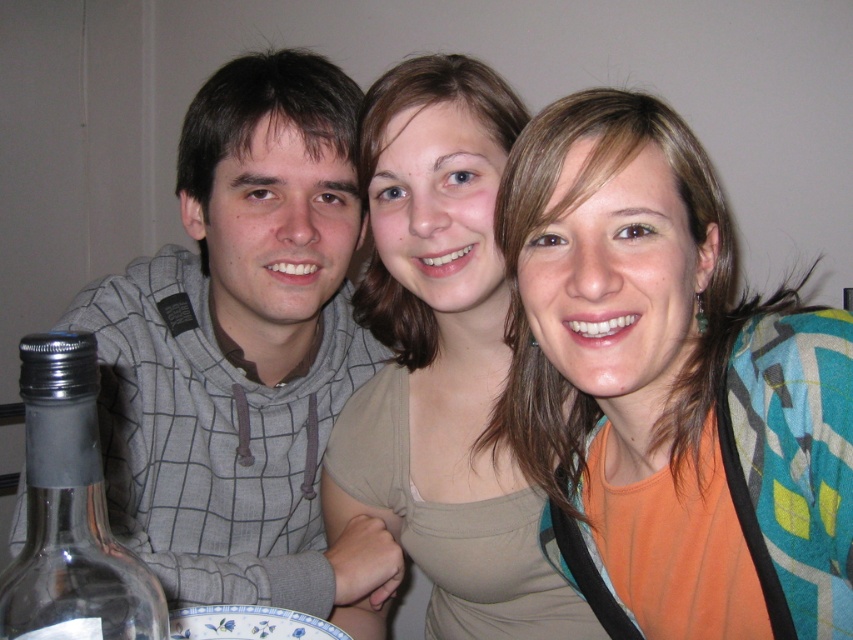
Question: Which of the following is the closest to the observer?

Choices:
 (A) (584, 346)
 (B) (276, 611)

Answer: (A)

Question: Which of the following is the closest to the observer?

Choices:
 (A) (424, 564)
 (B) (50, 403)

Answer: (B)

Question: In this image, where is orange fabric at center located relative to transparent glass bottle at left?

Choices:
 (A) below
 (B) above

Answer: (B)

Question: Which point is closer to the camera?

Choices:
 (A) blue and white ceramic plate at lower center
 (B) gray checkered hoodie at left

Answer: (A)

Question: Does orange fabric at center appear over blue and white ceramic plate at lower center?

Choices:
 (A) no
 (B) yes

Answer: (B)

Question: Can you confirm if matte beige tank top at center is smaller than blue and white ceramic plate at lower center?

Choices:
 (A) yes
 (B) no

Answer: (B)